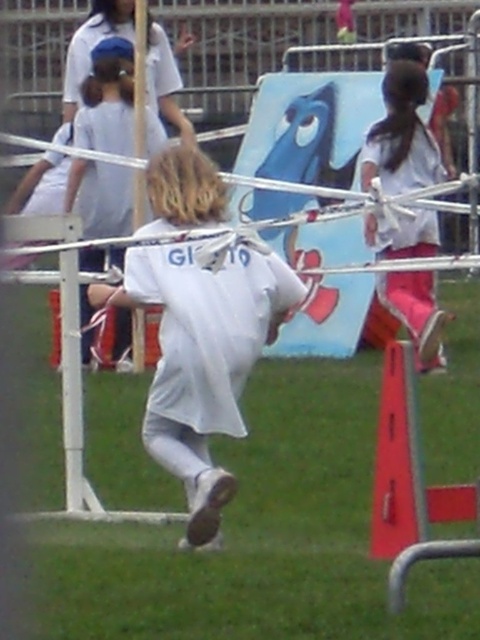
Question: Which of the following is the closest to the observer?

Choices:
 (A) pink fabric pants at right
 (B) white matte shirt at center

Answer: (B)

Question: Is white matte shirt at center in front of pink fabric pants at right?

Choices:
 (A) yes
 (B) no

Answer: (A)

Question: Among these points, which one is nearest to the camera?

Choices:
 (A) (367, 161)
 (B) (160, 355)

Answer: (B)

Question: Can you confirm if white matte shirt at center is smaller than pink fabric pants at right?

Choices:
 (A) no
 (B) yes

Answer: (A)

Question: Does white matte shirt at center have a lesser width compared to pink fabric pants at right?

Choices:
 (A) no
 (B) yes

Answer: (A)